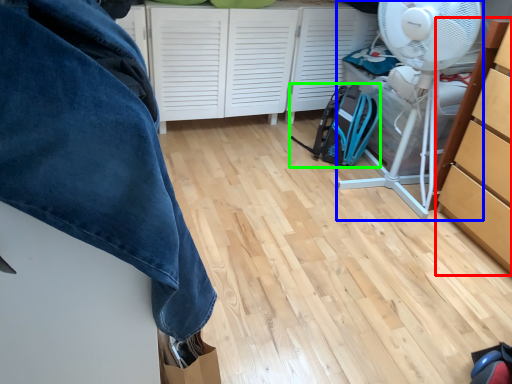
Question: Based on their relative distances, which object is farther from cabinetry (highlighted by a red box)? Choose from mechanical fan (highlighted by a blue box) and backpack (highlighted by a green box).

Choices:
 (A) mechanical fan
 (B) backpack

Answer: (B)